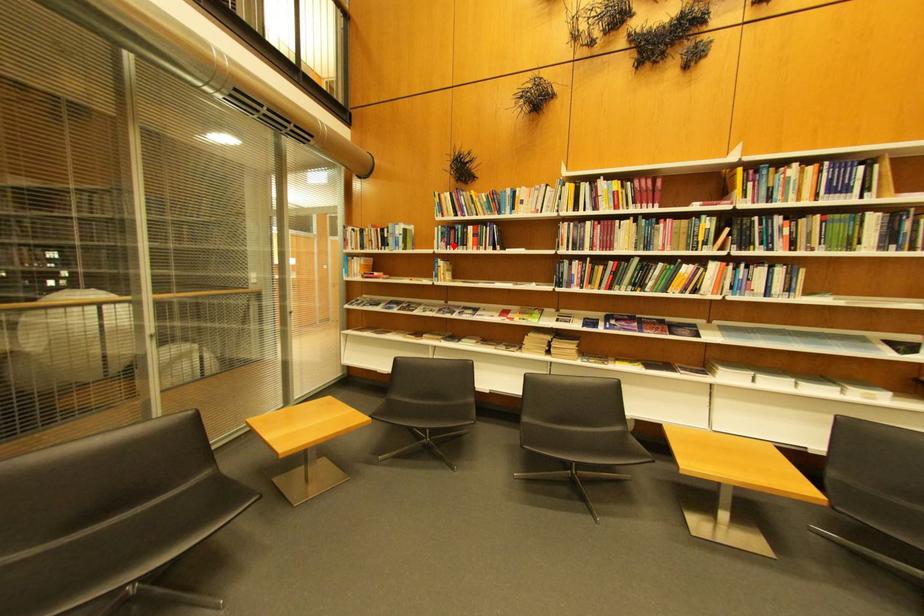
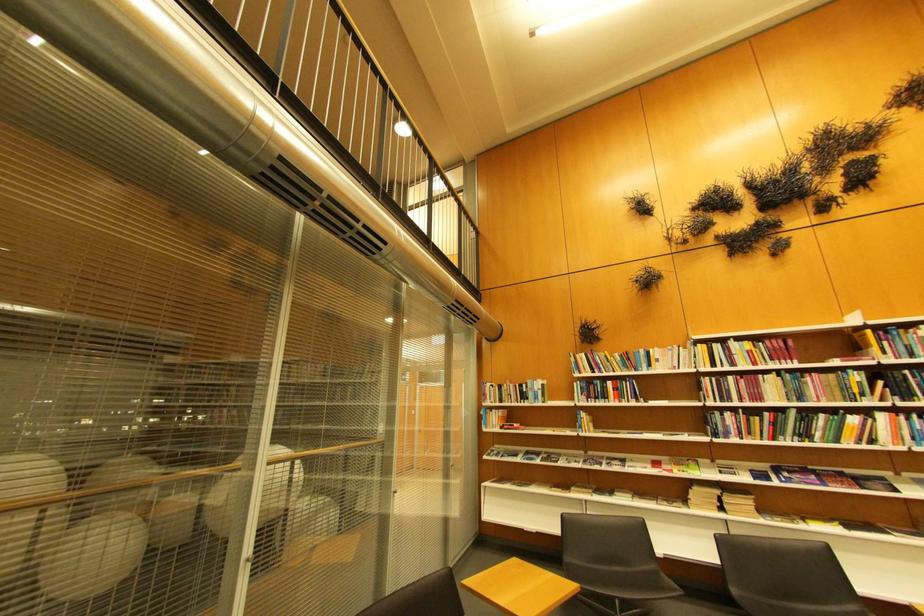
Question: A red point is marked in image1. In image2, is the corresponding 3D point closer to the camera or farther? Reply with the corresponding letter.

Choices:
 (A) The corresponding 3D point is closer.
 (B) The corresponding 3D point is farther.

Answer: (B)